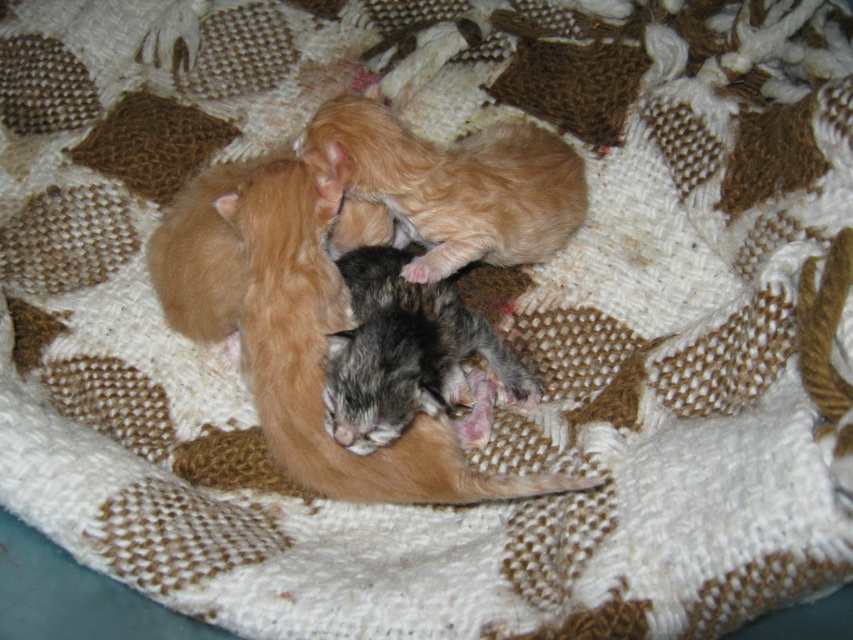
Question: Can you confirm if gray fluffy kitten at center is bigger than fuzzy orange cat at upper center?

Choices:
 (A) no
 (B) yes

Answer: (A)

Question: Estimate the real-world distances between objects in this image. Which object is closer to the gray fluffy kitten at center?

Choices:
 (A) fuzzy orange cat at upper center
 (B) gray fur kitten at center

Answer: (B)

Question: Can you confirm if fuzzy orange cat at upper center is positioned to the right of gray fur kitten at center?

Choices:
 (A) yes
 (B) no

Answer: (A)

Question: Which object is farther from the camera taking this photo?

Choices:
 (A) gray fur kitten at center
 (B) gray fluffy kitten at center
 (C) fuzzy orange cat at upper center

Answer: (C)

Question: Is gray fluffy kitten at center bigger than gray fur kitten at center?

Choices:
 (A) yes
 (B) no

Answer: (A)

Question: Which point is farther from the camera taking this photo?

Choices:
 (A) (393, 394)
 (B) (398, 502)

Answer: (B)